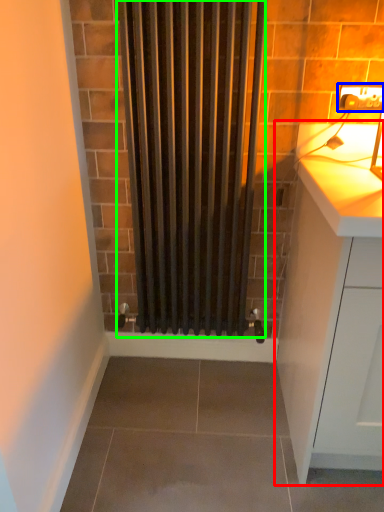
Question: Which object is the closest to the cabinetry (highlighted by a red box)? Choose among these: electric outlet (highlighted by a blue box) or shower curtain (highlighted by a green box).

Choices:
 (A) electric outlet
 (B) shower curtain

Answer: (B)